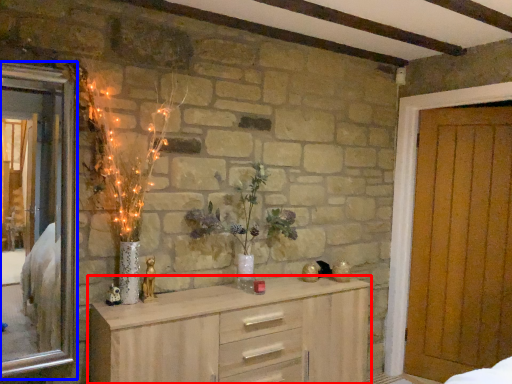
Question: Which point is closer to the camera, chest of drawers (highlighted by a red box) or window (highlighted by a blue box)?

Choices:
 (A) chest of drawers
 (B) window

Answer: (A)